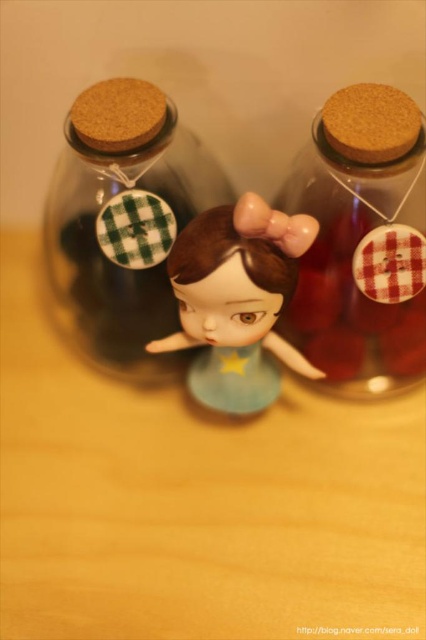
Question: Which object is positioned farthest from the transparent glass jar at center?

Choices:
 (A) matte plastic doll at center
 (B) red plaid cork at right

Answer: (B)

Question: Is transparent glass jar at center bigger than matte plastic doll at center?

Choices:
 (A) yes
 (B) no

Answer: (A)

Question: Can you confirm if transparent glass jar at center is wider than matte plastic doll at center?

Choices:
 (A) no
 (B) yes

Answer: (B)

Question: Which point is farther from the camera taking this photo?

Choices:
 (A) (207, 317)
 (B) (123, 291)

Answer: (B)

Question: Among these points, which one is nearest to the camera?

Choices:
 (A) (69, 291)
 (B) (385, 324)

Answer: (B)

Question: Is red plaid cork at right smaller than transparent glass jar at center?

Choices:
 (A) no
 (B) yes

Answer: (B)